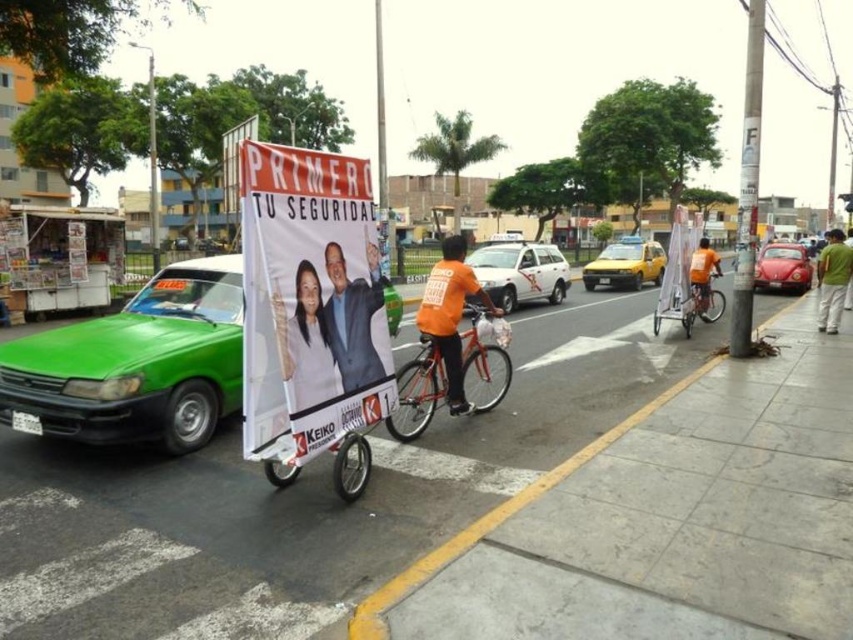
Is white paper banner at center taller than green fabric shirt at lower right?

Yes, white paper banner at center is taller than green fabric shirt at lower right.

Is white paper banner at center closer to camera compared to green fabric shirt at lower right?

That is True.

Which is in front, point (268, 195) or point (834, 273)?

Positioned in front is point (268, 195).

The height and width of the screenshot is (640, 853). I want to click on white paper banner at center, so click(309, 301).

Does green matte car at left have a lesser width compared to matte orange bicycle at center?

No.

Does green matte car at left have a lesser height compared to matte orange bicycle at center?

In fact, green matte car at left may be taller than matte orange bicycle at center.

Which is behind, point (120, 435) or point (486, 358)?

The point (486, 358) is behind.

Where is `green matte car at left`? green matte car at left is located at coordinates (136, 364).

Is point (316, 317) positioned behind point (332, 324)?

No.

Between point (344, 294) and point (355, 291), which one is positioned behind?

Point (355, 291)

I want to click on white paper banner at center, so click(x=309, y=301).